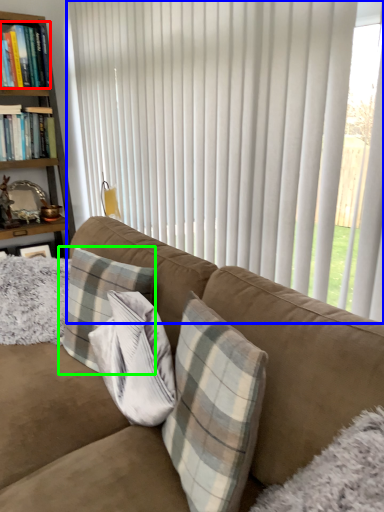
Question: Estimate the real-world distances between objects in this image. Which object is farther from book (highlighted by a red box), curtain (highlighted by a blue box) or pillow (highlighted by a green box)?

Choices:
 (A) curtain
 (B) pillow

Answer: (B)